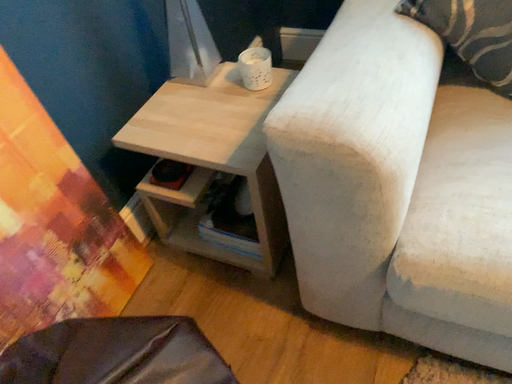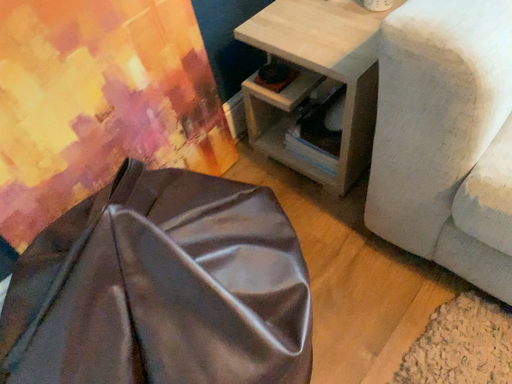
Question: Which way did the camera rotate in the video?

Choices:
 (A) rotated right
 (B) rotated left

Answer: (B)